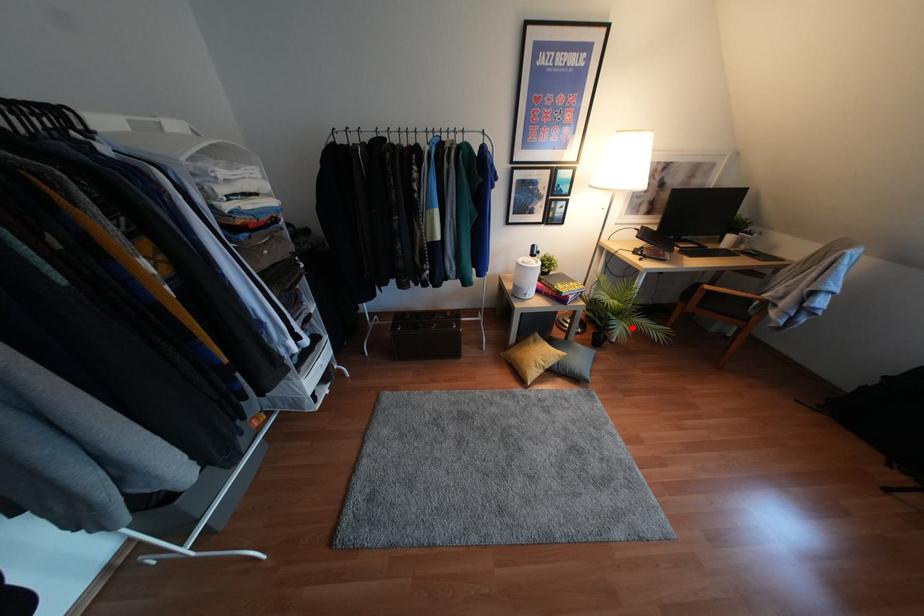
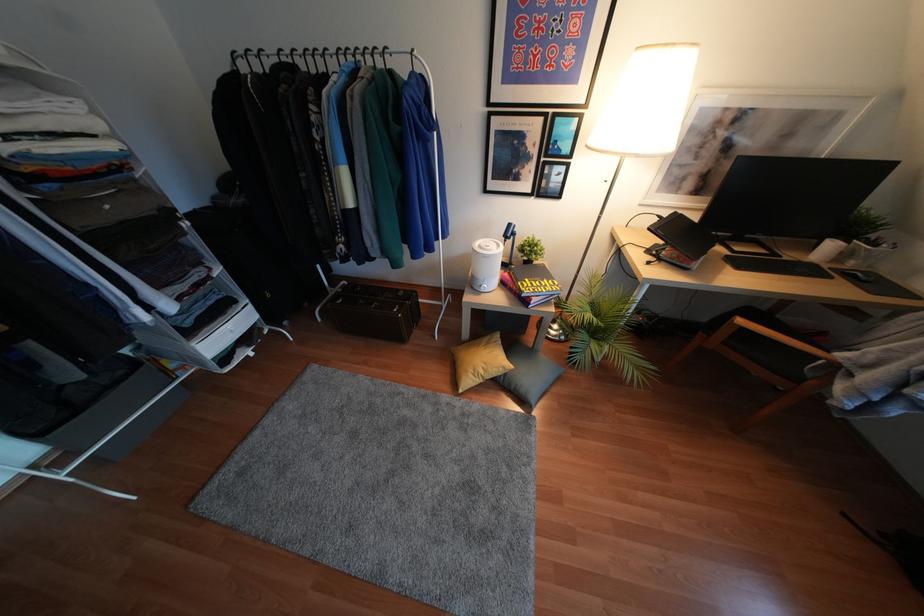
Locate, in the second image, the point that corresponds to the highlighted location in the first image.

(604, 357)